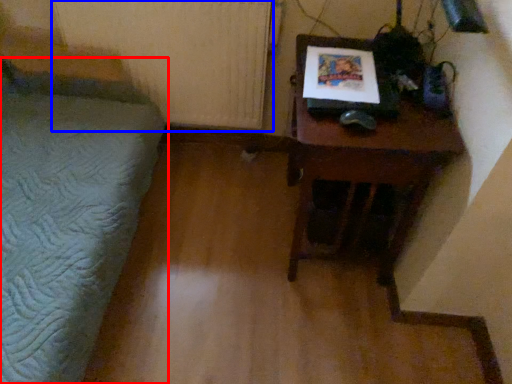
Question: Which object appears farthest to the camera in this image, furniture (highlighted by a red box) or radiator (highlighted by a blue box)?

Choices:
 (A) furniture
 (B) radiator

Answer: (B)